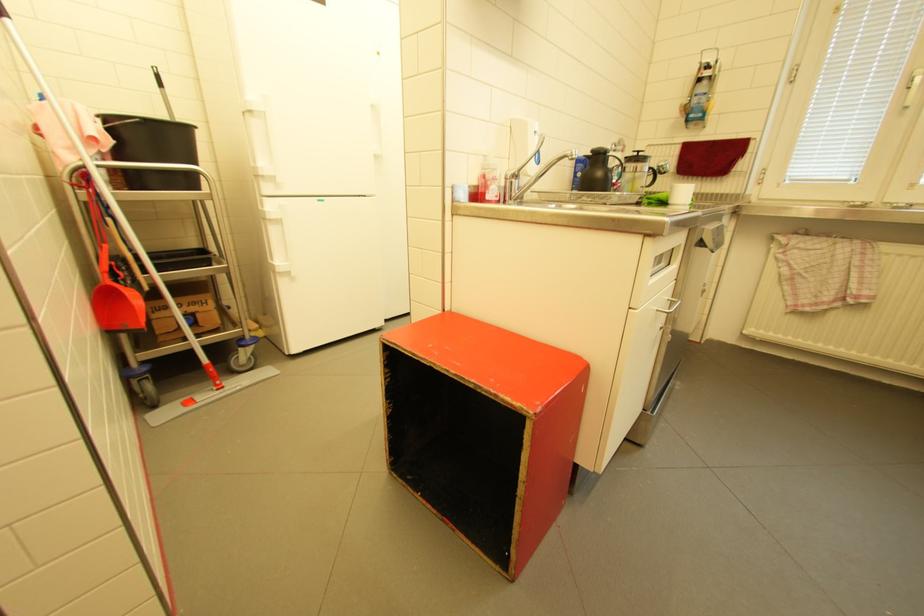
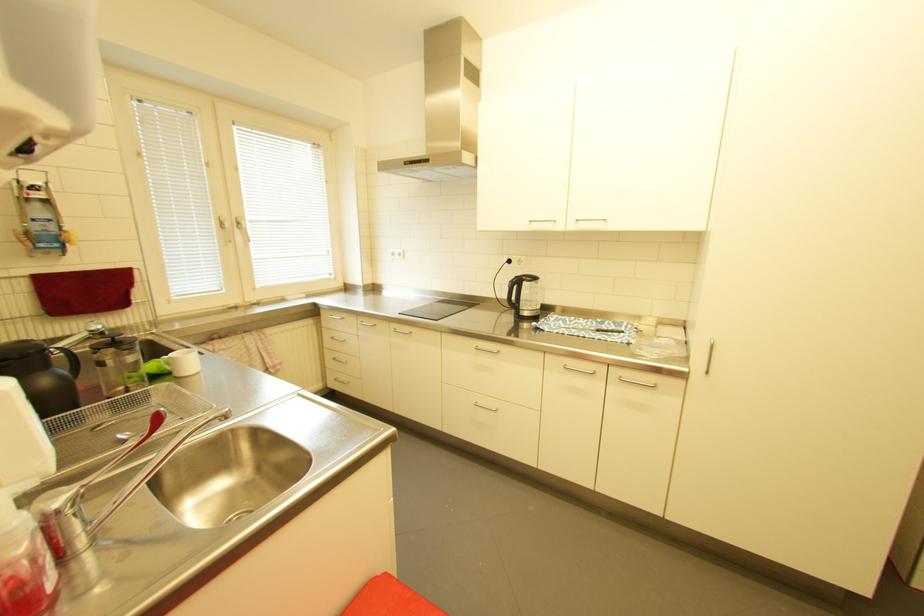
The images are taken continuously from a first-person perspective. In which direction is your viewpoint rotating?

The camera's rotation is toward right-down.